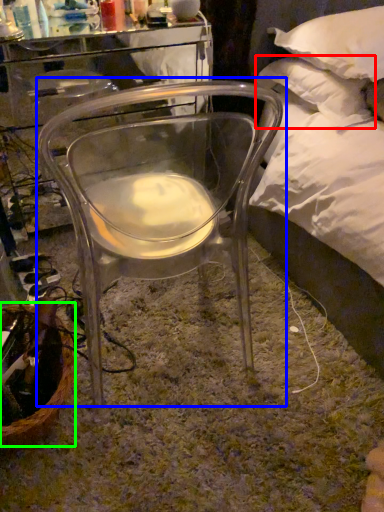
Question: Which object is the farthest from pillow (highlighted by a red box)? Choose among these: chair (highlighted by a blue box) or basket (highlighted by a green box).

Choices:
 (A) chair
 (B) basket

Answer: (B)